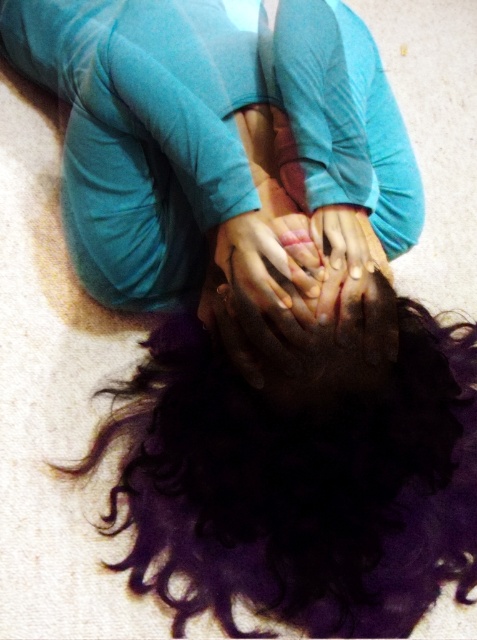
You are a photographer setting up for a portrait session. You notice the dark curly hair at center and smooth skin hands at center in the scene. To ensure the hands are visible in the final shot, where should you position the lighting relative to the hands?

The dark curly hair at center is below smooth skin hands at center. To ensure visibility, position the light above the hands so it illuminates them from above, avoiding shadows cast by the hair.

You are a photographer setting up a closeup shot of the person in the scene. You need to frame the dark curly hair at center and smooth skin hands at center such that both are visible. Given their widths, which object should you adjust the camera focus to prioritize to ensure both fit in the frame?

The dark curly hair at center is wider than the smooth skin hands at center. To ensure both fit in the frame, prioritize focusing on the dark curly hair at center first since it occupies more space, then adjust the framing to include the smooth skin hands at center.

You are a photographer setting up a shoot in the described scene. You need to place a small prop between the dark curly hair at center and the smooth skin hands at center. Based on their positions, which side of the hands should the prop be placed on?

The dark curly hair at center is positioned on the right side of smooth skin hands at center, so the prop should be placed on the right side of the hands.